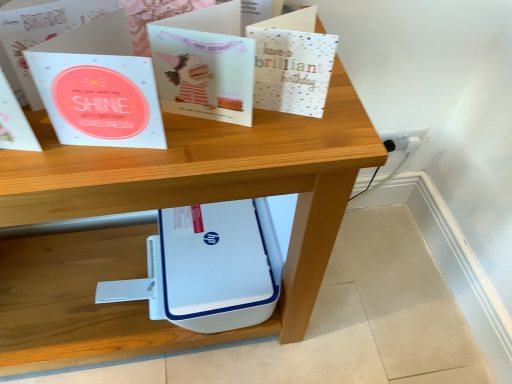
Where is `matte paper card at center, acting as the second paperback book starting from the left`? The height and width of the screenshot is (384, 512). matte paper card at center, acting as the second paperback book starting from the left is located at coordinates (204, 74).

Where is `white plastic socket at lower right`? The image size is (512, 384). white plastic socket at lower right is located at coordinates (403, 139).

This screenshot has height=384, width=512. Describe the element at coordinates (292, 70) in the screenshot. I see `metallic silver card at upper center, which appears as the first paperback book when viewed from the right` at that location.

At what (x,y) coordinates should I click in order to perform the action: click on metallic silver card at upper center, which is the third paperback book in left-to-right order. Please return your answer as a coordinate pair (x, y). Looking at the image, I should click on (292, 70).

The height and width of the screenshot is (384, 512). What do you see at coordinates (99, 99) in the screenshot?
I see `light blue paper at center, which is counted as the third paperback book, starting from the right` at bounding box center [99, 99].

Locate an element on the screen. The image size is (512, 384). matte paper card at center, acting as the second paperback book starting from the left is located at coordinates (204, 74).

Is white plastic socket at lower right next to white plastic printer at center and touching it?

white plastic socket at lower right and white plastic printer at center are clearly separated.

From a real-world perspective, is white plastic socket at lower right above or below white plastic printer at center?

From a real-world perspective, white plastic socket at lower right is physically below white plastic printer at center.

This screenshot has width=512, height=384. Find the location of `electric outlet behind the white plastic printer at center`. electric outlet behind the white plastic printer at center is located at coordinates (403, 139).

Does white plastic socket at lower right have a lesser width compared to white plastic printer at center?

Indeed, white plastic socket at lower right has a lesser width compared to white plastic printer at center.

Is white plastic printer at center oriented away from matte paper card at center, which ranks as the 2th paperback book in right-to-left order?

No, white plastic printer at center is not facing away from matte paper card at center, which ranks as the 2th paperback book in right-to-left order.

Between white plastic printer at center and matte paper card at center, which ranks as the 2th paperback book in right-to-left order, which one has larger size?

With larger size is white plastic printer at center.

Is white plastic printer at center to the left or to the right of matte paper card at center, acting as the second paperback book starting from the left, in the image?

Clearly, white plastic printer at center is on the left of matte paper card at center, acting as the second paperback book starting from the left, in the image.

From the picture: Is white plastic printer at center not inside matte paper card at center, which ranks as the 2th paperback book in right-to-left order?

That's correct, white plastic printer at center is outside of matte paper card at center, which ranks as the 2th paperback book in right-to-left order.

How distant is matte paper card at center, which ranks as the 2th paperback book in right-to-left order, from white plastic socket at lower right?

matte paper card at center, which ranks as the 2th paperback book in right-to-left order, and white plastic socket at lower right are 32.29 inches apart from each other.

Between matte paper card at center, acting as the second paperback book starting from the left, and white plastic socket at lower right, which one has larger width?

With larger width is matte paper card at center, acting as the second paperback book starting from the left.

From a real-world perspective, is matte paper card at center, acting as the second paperback book starting from the left, physically located above or below white plastic socket at lower right?

matte paper card at center, acting as the second paperback book starting from the left, is above white plastic socket at lower right.

Is matte paper card at center, acting as the second paperback book starting from the left, not inside white plastic socket at lower right?

Yes, matte paper card at center, acting as the second paperback book starting from the left, is outside of white plastic socket at lower right.

How many degrees apart are the facing directions of metallic silver card at upper center, which appears as the first paperback book when viewed from the right, and matte paper card at center, which ranks as the 2th paperback book in right-to-left order?

The angle between the facing direction of metallic silver card at upper center, which appears as the first paperback book when viewed from the right, and the facing direction of matte paper card at center, which ranks as the 2th paperback book in right-to-left order, is 2.08 degrees.

Between metallic silver card at upper center, which appears as the first paperback book when viewed from the right, and matte paper card at center, which ranks as the 2th paperback book in right-to-left order, which one has larger width?

matte paper card at center, which ranks as the 2th paperback book in right-to-left order, is wider.

Considering the positions of point (304, 110) and point (190, 39), is point (304, 110) closer or farther from the camera than point (190, 39)?

Point (304, 110) is farther from the camera than point (190, 39).

From the image's perspective, is metallic silver card at upper center, which is the third paperback book in left-to-right order, positioned above or below matte paper card at center, acting as the second paperback book starting from the left?

metallic silver card at upper center, which is the third paperback book in left-to-right order, is below matte paper card at center, acting as the second paperback book starting from the left.

Considering the sizes of objects metallic silver card at upper center, which is the third paperback book in left-to-right order, and white plastic socket at lower right in the image provided, who is wider, metallic silver card at upper center, which is the third paperback book in left-to-right order, or white plastic socket at lower right?

With larger width is metallic silver card at upper center, which is the third paperback book in left-to-right order.

Which point is more forward, (273, 44) or (396, 145)?

The point (273, 44) is closer.

Where is `electric outlet on the right side of metallic silver card at upper center, which is the third paperback book in left-to-right order`? This screenshot has width=512, height=384. electric outlet on the right side of metallic silver card at upper center, which is the third paperback book in left-to-right order is located at coordinates pos(403,139).

Is the depth of metallic silver card at upper center, which is the third paperback book in left-to-right order, greater than that of white plastic socket at lower right?

No, it is not.

Based on the photo, considering the relative sizes of white plastic printer at center and metallic silver card at upper center, which appears as the first paperback book when viewed from the right, in the image provided, is white plastic printer at center bigger than metallic silver card at upper center, which appears as the first paperback book when viewed from the right,?

Indeed, white plastic printer at center has a larger size compared to metallic silver card at upper center, which appears as the first paperback book when viewed from the right.

From a real-world perspective, which is physically above, white plastic printer at center or metallic silver card at upper center, which is the third paperback book in left-to-right order?

metallic silver card at upper center, which is the third paperback book in left-to-right order, is physically above.

Which is in front, point (12, 353) or point (274, 95)?

Positioned in front is point (274, 95).

Is white plastic printer at center aimed at metallic silver card at upper center, which appears as the first paperback book when viewed from the right?

No, white plastic printer at center is not oriented towards metallic silver card at upper center, which appears as the first paperback book when viewed from the right.

Does metallic silver card at upper center, which is the third paperback book in left-to-right order, lie behind light blue paper at center, which is counted as the third paperback book, starting from the right?

Yes.

Is metallic silver card at upper center, which appears as the first paperback book when viewed from the right, situated inside light blue paper at center, which is the 1th paperback book in left-to-right order, or outside?

metallic silver card at upper center, which appears as the first paperback book when viewed from the right, lies outside light blue paper at center, which is the 1th paperback book in left-to-right order.

Considering the relative sizes of metallic silver card at upper center, which appears as the first paperback book when viewed from the right, and light blue paper at center, which is the 1th paperback book in left-to-right order, in the image provided, is metallic silver card at upper center, which appears as the first paperback book when viewed from the right, taller than light blue paper at center, which is the 1th paperback book in left-to-right order,?

In fact, metallic silver card at upper center, which appears as the first paperback book when viewed from the right, may be shorter than light blue paper at center, which is the 1th paperback book in left-to-right order.

Find the location of a particular element. Image resolution: width=512 pixels, height=384 pixels. desk located below the white plastic socket at lower right (from the image's perspective) is located at coordinates (155, 226).

The image size is (512, 384). Identify the location of desk on the left of the matte paper card at center, which ranks as the 2th paperback book in right-to-left order. (155, 226).

Looking at the image, which one is located further to matte paper card at center, which ranks as the 2th paperback book in right-to-left order, metallic silver card at upper center, which appears as the first paperback book when viewed from the right, or white plastic socket at lower right?

The object further to matte paper card at center, which ranks as the 2th paperback book in right-to-left order, is white plastic socket at lower right.

When comparing their distances from matte paper card at center, which ranks as the 2th paperback book in right-to-left order, does metallic silver card at upper center, which is the third paperback book in left-to-right order, or white plastic printer at center seem further?

white plastic printer at center is positioned further to the anchor matte paper card at center, which ranks as the 2th paperback book in right-to-left order.

Considering their positions, is light blue paper at center, which is counted as the third paperback book, starting from the right, positioned closer to metallic silver card at upper center, which is the third paperback book in left-to-right order, than white plastic printer at center?

Among the two, light blue paper at center, which is counted as the third paperback book, starting from the right, is located nearer to metallic silver card at upper center, which is the third paperback book in left-to-right order.

Which object lies nearer to the anchor point white plastic printer at center, matte paper card at center, which ranks as the 2th paperback book in right-to-left order, or white plastic socket at lower right?

matte paper card at center, which ranks as the 2th paperback book in right-to-left order, lies closer to white plastic printer at center than the other object.

Estimate the real-world distances between objects in this image. Which object is further from white plastic socket at lower right, metallic silver card at upper center, which appears as the first paperback book when viewed from the right, or matte paper card at center, acting as the second paperback book starting from the left?

matte paper card at center, acting as the second paperback book starting from the left.

From the image, which object appears to be farther from metallic silver card at upper center, which appears as the first paperback book when viewed from the right, light blue paper at center, which is counted as the third paperback book, starting from the right, or matte paper card at center, acting as the second paperback book starting from the left?

light blue paper at center, which is counted as the third paperback book, starting from the right, lies further to metallic silver card at upper center, which appears as the first paperback book when viewed from the right, than the other object.

From the image, which object appears to be farther from matte paper card at center, acting as the second paperback book starting from the left, metallic silver card at upper center, which appears as the first paperback book when viewed from the right, or light blue paper at center, which is the 1th paperback book in left-to-right order?

light blue paper at center, which is the 1th paperback book in left-to-right order.

Considering their positions, is white plastic socket at lower right positioned closer to white plastic printer at center than matte paper card at center, acting as the second paperback book starting from the left?

Among the two, matte paper card at center, acting as the second paperback book starting from the left, is located nearer to white plastic printer at center.

The width and height of the screenshot is (512, 384). Identify the location of paperback book situated between light blue paper at center, which is the 1th paperback book in left-to-right order, and metallic silver card at upper center, which appears as the first paperback book when viewed from the right, from left to right. (204, 74).

Locate an element on the screen. The height and width of the screenshot is (384, 512). paperback book located between matte paper card at center, which ranks as the 2th paperback book in right-to-left order, and white plastic socket at lower right in the depth direction is located at coordinates (292, 70).